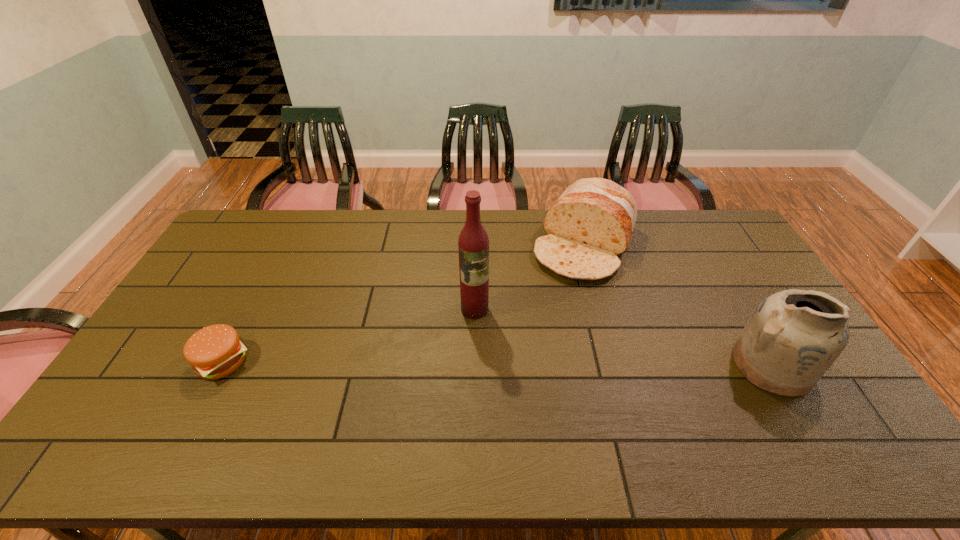
Where is `vacant spot on the desktop that is between the hamburger and the third shortest object and is positioned on the label of the second object from left to right`? vacant spot on the desktop that is between the hamburger and the third shortest object and is positioned on the label of the second object from left to right is located at coordinates (482, 363).

Identify the location of vacant space on the desktop that is between the shortest object and the second tallest object and is positioned at the sliced end of the farthest object. (521, 363).